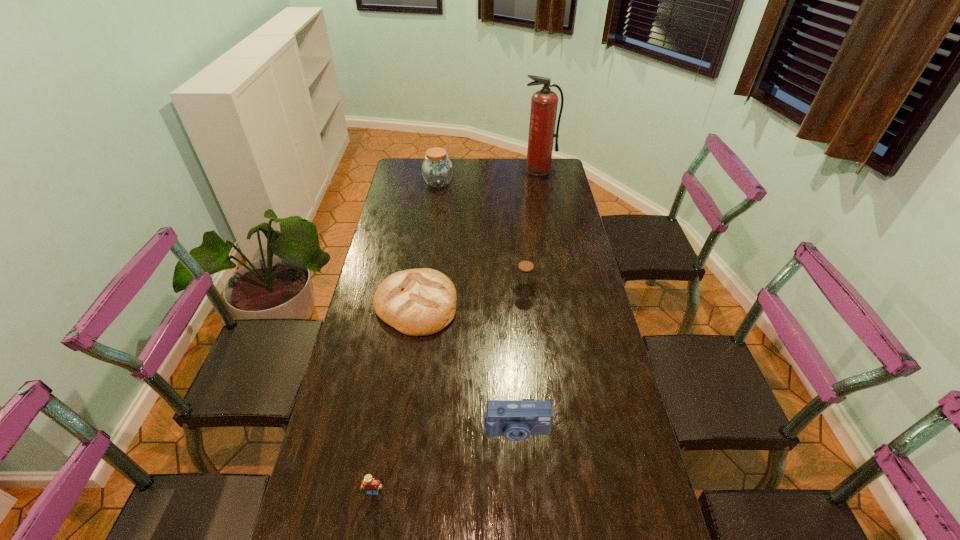
You are a GUI agent. You are given a task and a screenshot of the screen. Output one action in this format:
    pyautogui.click(x=<x>, y=<y>)
    Task: Click on the rightmost object
    The width and height of the screenshot is (960, 540).
    Given the screenshot: What is the action you would take?
    pyautogui.click(x=544, y=103)

Identify the location of fire extinguisher. 544,103.

Where is `the fifth shortest object`? the fifth shortest object is located at coordinates (437, 170).

Where is `the farther jar`? the farther jar is located at coordinates (437, 170).

Image resolution: width=960 pixels, height=540 pixels. Find the location of `the right jar`. the right jar is located at coordinates (525, 274).

Identify the location of the shorter jar. (525, 274).

I want to click on camera, so click(x=516, y=420).

The height and width of the screenshot is (540, 960). What are the coordinates of `bread` in the screenshot? It's located at coord(417,302).

Find the location of a particular element. the nearest object is located at coordinates (369, 483).

Where is `free point located 0.090m at the nozzle of the rightmost object`? This screenshot has width=960, height=540. free point located 0.090m at the nozzle of the rightmost object is located at coordinates (541, 186).